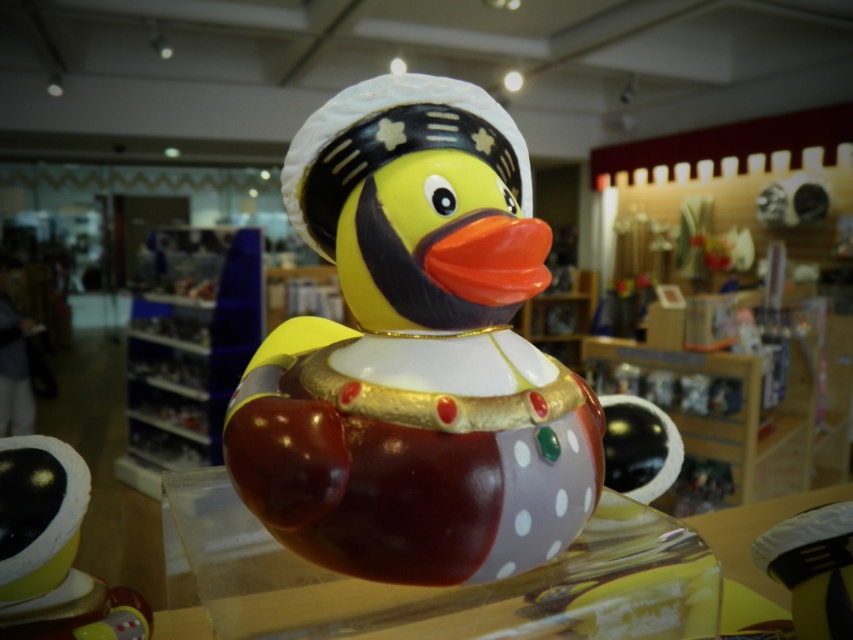
You are a customer in a souvenir shop and want to find the polished ceramic duck at center. According to the store layout, which coordinates should you look for?

The polished ceramic duck at center is located at coordinates point [415,353].

You are a customer in a souvenir shop and see two ducks displayed on a shelf. The polished ceramic duck at center and the shiny gold duck at center. Which one is placed higher on the shelf?

The polished ceramic duck at center is placed higher on the shelf than the shiny gold duck at center.